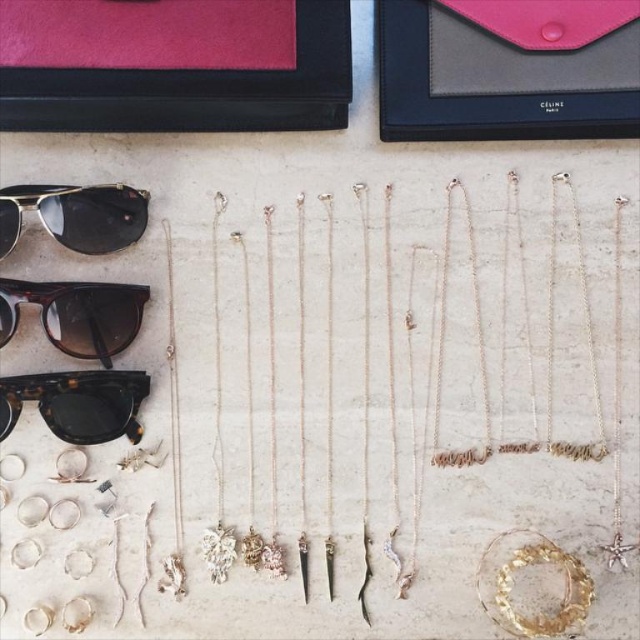
You are standing in front of the jewelry display and want to locate the point at coordinates point (77, 403). Which object is this point located on?

The point (77, 403) is located on the tortoiseshell acetate sunglasses at lower left.

You are a customer in a store and want to pick up the tortoiseshell acetate sunglasses at lower left and the metallic reflective sunglasses at upper left. Which one should you reach for first if you want to grab the one closer to you?

The tortoiseshell acetate sunglasses at lower left is positioned under the metallic reflective sunglasses at upper left, so it is closer to you. You should reach for the tortoiseshell acetate sunglasses at lower left first.

You are organizing a display and need to place a new item between the brown tortoiseshell sunglasses at upper left and the necklaces to the right. Based on their positions, where should you place the new item?

The new item should be placed to the right of the brown tortoiseshell sunglasses at upper left since the necklaces are already positioned to the right of it.